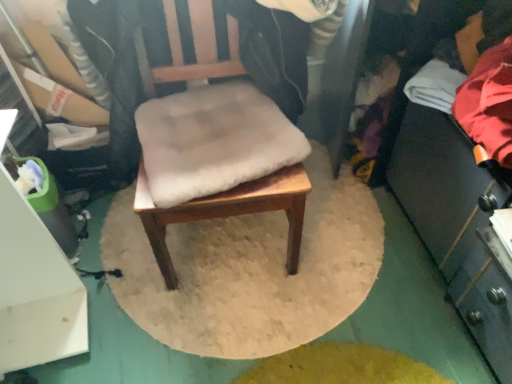
Question: Can you confirm if white soft cushion at center is wider than wooden chair at center?

Choices:
 (A) no
 (B) yes

Answer: (A)

Question: From the image's perspective, does white soft cushion at center appear higher than wooden chair at center?

Choices:
 (A) no
 (B) yes

Answer: (A)

Question: Considering the relative sizes of white soft cushion at center and wooden chair at center in the image provided, is white soft cushion at center bigger than wooden chair at center?

Choices:
 (A) no
 (B) yes

Answer: (A)

Question: Are white soft cushion at center and wooden chair at center located far from each other?

Choices:
 (A) yes
 (B) no

Answer: (B)

Question: From a real-world perspective, is white soft cushion at center physically below wooden chair at center?

Choices:
 (A) no
 (B) yes

Answer: (B)

Question: Can you confirm if white soft cushion at center is positioned to the right of wooden chair at center?

Choices:
 (A) no
 (B) yes

Answer: (A)

Question: Can you confirm if wooden chair at center is taller than red fabric at right?

Choices:
 (A) yes
 (B) no

Answer: (A)

Question: Can you confirm if wooden chair at center is wider than red fabric at right?

Choices:
 (A) yes
 (B) no

Answer: (A)

Question: From the image's perspective, is wooden chair at center over red fabric at right?

Choices:
 (A) no
 (B) yes

Answer: (A)

Question: Does wooden chair at center have a smaller size compared to red fabric at right?

Choices:
 (A) yes
 (B) no

Answer: (B)

Question: Would you say wooden chair at center is a long distance from red fabric at right?

Choices:
 (A) yes
 (B) no

Answer: (B)

Question: From the image's perspective, is wooden chair at center under red fabric at right?

Choices:
 (A) yes
 (B) no

Answer: (A)

Question: Considering the relative sizes of red fabric at right and white soft cushion at center in the image provided, is red fabric at right shorter than white soft cushion at center?

Choices:
 (A) yes
 (B) no

Answer: (B)